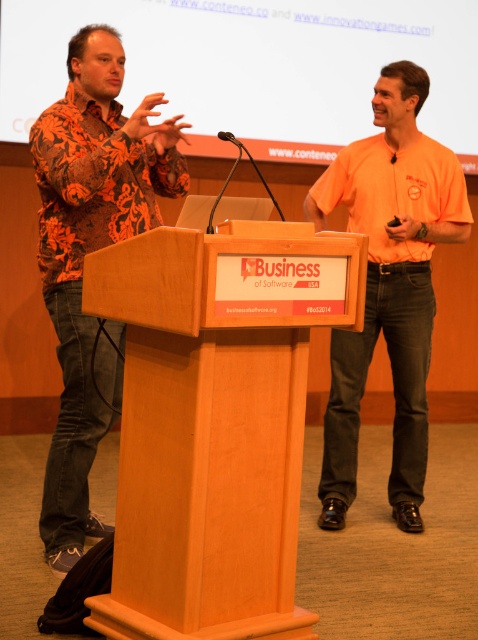
Does matte white screen at upper center lie in front of orange cotton shirt at center?

No, matte white screen at upper center is behind orange cotton shirt at center.

Is matte white screen at upper center to the right of orange cotton shirt at center from the viewer's perspective?

Incorrect, matte white screen at upper center is not on the right side of orange cotton shirt at center.

This screenshot has height=640, width=478. In order to click on matte white screen at upper center in this screenshot , I will do pos(256,67).

Which is below, matte white screen at upper center or floral-patterned shirt at left?

Positioned lower is floral-patterned shirt at left.

Identify the location of matte white screen at upper center. The width and height of the screenshot is (478, 640). (256, 67).

Locate an element on the screen. This screenshot has width=478, height=640. matte white screen at upper center is located at coordinates (256, 67).

Does wooden podium at center appear over matte white screen at upper center?

No.

Between wooden podium at center and matte white screen at upper center, which one has more height?

Standing taller between the two is wooden podium at center.

I want to click on wooden podium at center, so click(x=215, y=420).

In order to click on wooden podium at center in this screenshot , I will do 215,420.